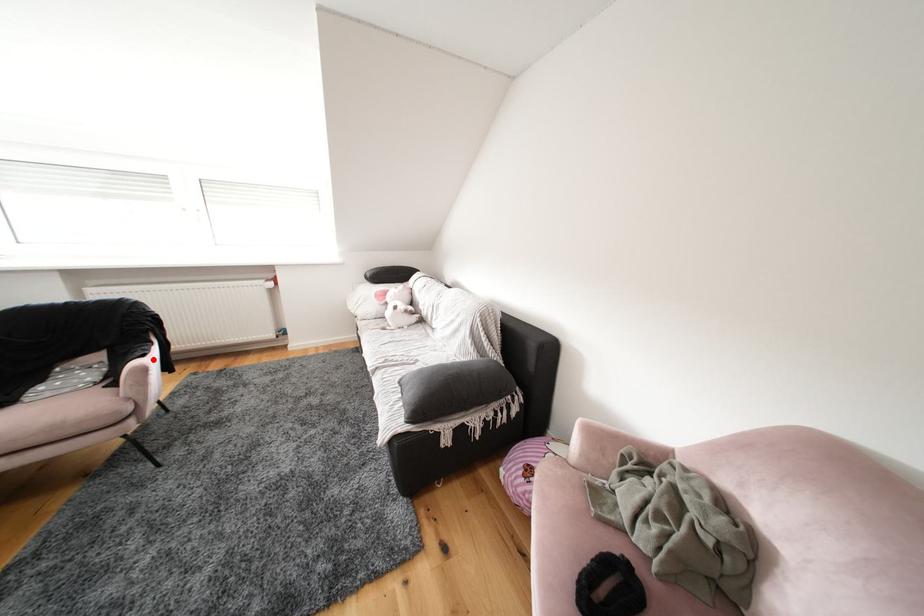
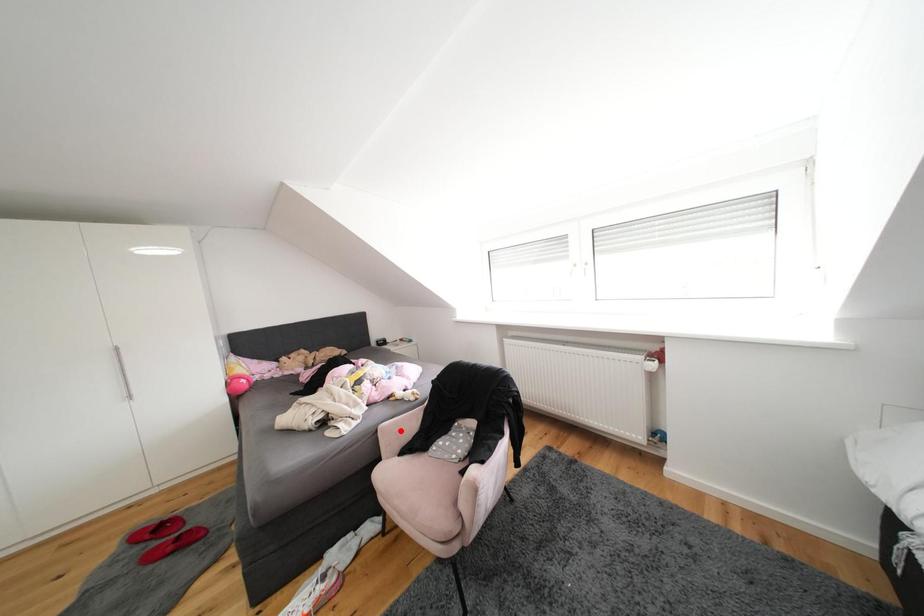
I am providing you with two images of the same scene from different viewpoints. A red point is marked on the first image and another point is marked on the second image. Does the point marked in image1 correspond to the same location as the one in image2?

No